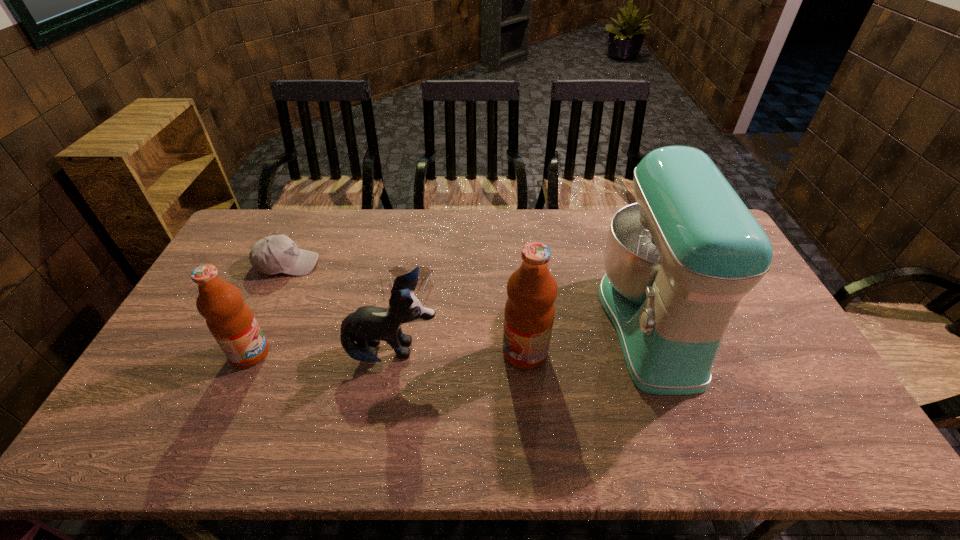
Find the location of `vacant spot to place a fruit juice on the right`. vacant spot to place a fruit juice on the right is located at coordinates (799, 353).